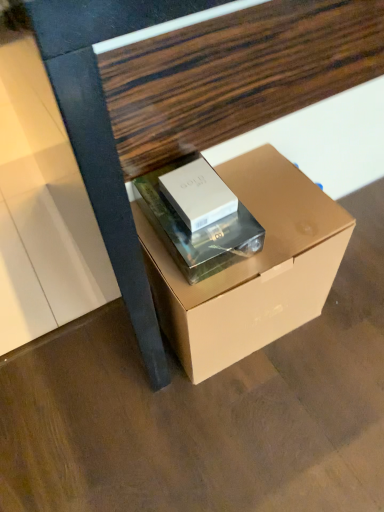
Question: Considering the relative sizes of matte cardboard box at center, which appears as the 2th box when viewed from the left, and silver metallic box at center, which is the second box from right to left, in the image provided, is matte cardboard box at center, which appears as the 2th box when viewed from the left, bigger than silver metallic box at center, which is the second box from right to left,?

Choices:
 (A) yes
 (B) no

Answer: (A)

Question: Is matte cardboard box at center, arranged as the first box when viewed from the right, not close to silver metallic box at center, which is the second box from right to left?

Choices:
 (A) yes
 (B) no

Answer: (B)

Question: From the image's perspective, is matte cardboard box at center, which appears as the 2th box when viewed from the left, over silver metallic box at center, acting as the first box starting from the left?

Choices:
 (A) yes
 (B) no

Answer: (B)

Question: From a real-world perspective, is matte cardboard box at center, arranged as the first box when viewed from the right, located higher than silver metallic box at center, acting as the first box starting from the left?

Choices:
 (A) no
 (B) yes

Answer: (A)

Question: Is matte cardboard box at center, which appears as the 2th box when viewed from the left, thinner than silver metallic box at center, which is the second box from right to left?

Choices:
 (A) no
 (B) yes

Answer: (A)

Question: From a real-world perspective, relative to matte white book at center, is matte cardboard box at center, arranged as the first box when viewed from the right, vertically above or below?

Choices:
 (A) above
 (B) below

Answer: (B)

Question: From their relative heights in the image, would you say matte cardboard box at center, which appears as the 2th box when viewed from the left, is taller or shorter than matte white book at center?

Choices:
 (A) tall
 (B) short

Answer: (A)

Question: Is matte cardboard box at center, arranged as the first box when viewed from the right, bigger or smaller than matte white book at center?

Choices:
 (A) small
 (B) big

Answer: (B)

Question: Considering the positions of matte cardboard box at center, which appears as the 2th box when viewed from the left, and matte white book at center in the image, is matte cardboard box at center, which appears as the 2th box when viewed from the left, wider or thinner than matte white book at center?

Choices:
 (A) wide
 (B) thin

Answer: (A)

Question: Is silver metallic box at center, which is the second box from right to left, to the left or to the right of matte cardboard box at center in the image?

Choices:
 (A) right
 (B) left

Answer: (B)

Question: From the image's perspective, relative to matte cardboard box at center, is silver metallic box at center, acting as the first box starting from the left, above or below?

Choices:
 (A) below
 (B) above

Answer: (A)

Question: Considering their positions, is silver metallic box at center, which is the second box from right to left, located in front of or behind matte cardboard box at center?

Choices:
 (A) behind
 (B) front

Answer: (A)

Question: From a real-world perspective, is silver metallic box at center, acting as the first box starting from the left, above or below matte cardboard box at center?

Choices:
 (A) above
 (B) below

Answer: (B)

Question: Considering the positions of matte white book at center and silver metallic box at center, acting as the first box starting from the left, in the image, is matte white book at center bigger or smaller than silver metallic box at center, acting as the first box starting from the left,?

Choices:
 (A) small
 (B) big

Answer: (B)

Question: Considering the positions of matte white book at center and silver metallic box at center, which is the second box from right to left, in the image, is matte white book at center taller or shorter than silver metallic box at center, which is the second box from right to left,?

Choices:
 (A) tall
 (B) short

Answer: (B)